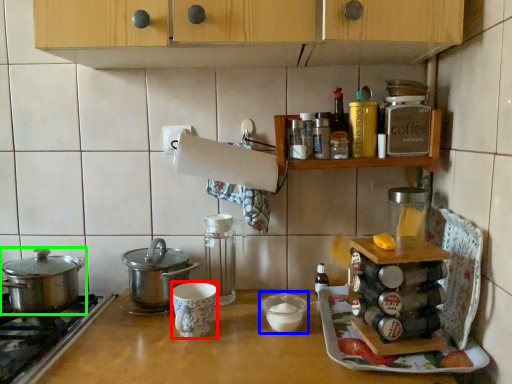
Question: Which is farther away from mug (highlighted by a red box)? appliance (highlighted by a blue box) or kitchen appliance (highlighted by a green box)?

Choices:
 (A) appliance
 (B) kitchen appliance

Answer: (B)